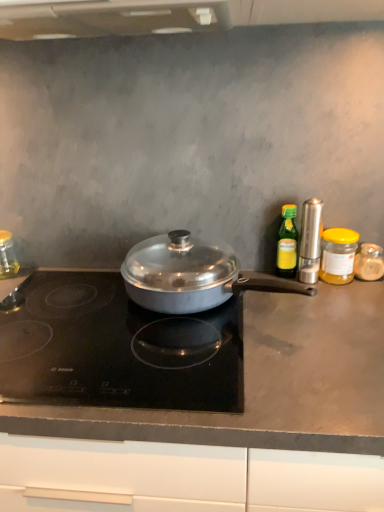
The height and width of the screenshot is (512, 384). I want to click on vacant area situated below satin silver pan at center, which ranks as the fifth kitchen appliance in right-to-left order (from a real-world perspective), so click(240, 306).